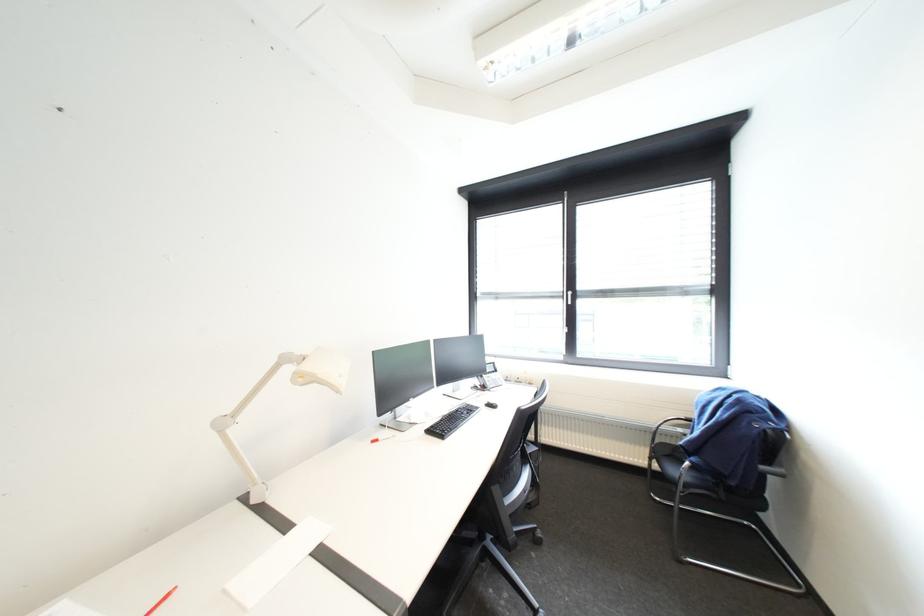
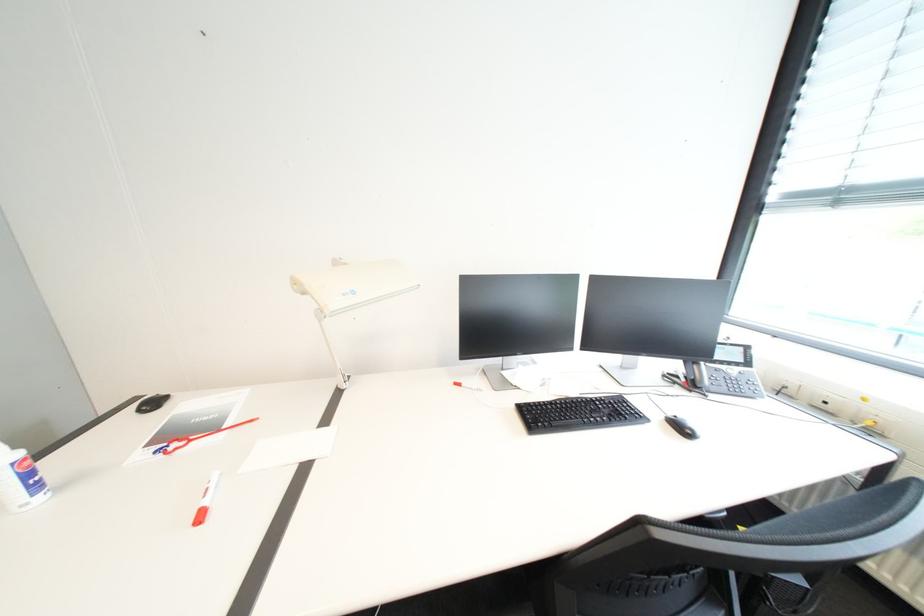
The images are taken continuously from a first-person perspective. In which direction is your viewpoint rotating?

The camera rotated toward left-down.